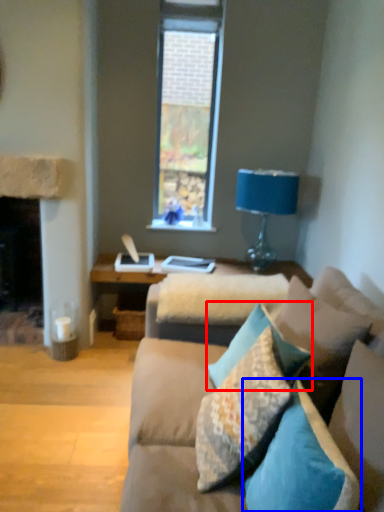
Question: Which object is further to the camera taking this photo, pillow (highlighted by a red box) or pillow (highlighted by a blue box)?

Choices:
 (A) pillow
 (B) pillow

Answer: (A)